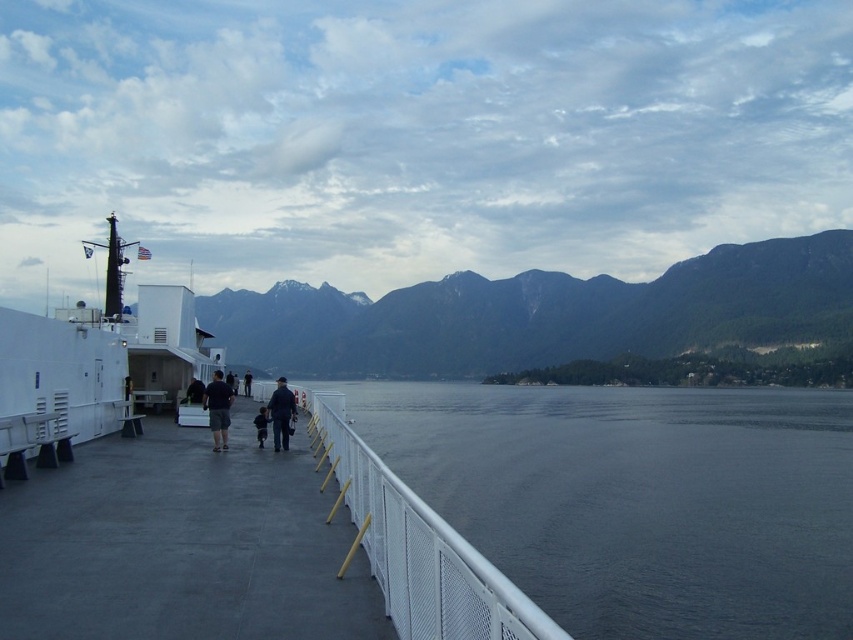
You are standing on the ferry and want to see the mountain view. There are two jackets hanging on a railing nearby. Which jacket is blocking your view of the mountains more, the dark blue fabric jacket at center or the black fabric jacket at center?

The black fabric jacket at center is behind the dark blue fabric jacket at center, so the dark blue fabric jacket at center is blocking your view more since it is in front.

You are standing at point (62, 502) on the ferry deck. You need to walk to the American flag on the flagpole near the smokestack. The ferry deck is 12 meters long from one end to the other. Can you reach the flagpole before the deck ends?

The distance between you at point (62, 502) and the American flag on the flagpole near the smokestack is 11.67 meters. Since the ferry deck is 12 meters long, you can reach the flagpole before the deck ends as 11.67 meters is less than 12 meters.